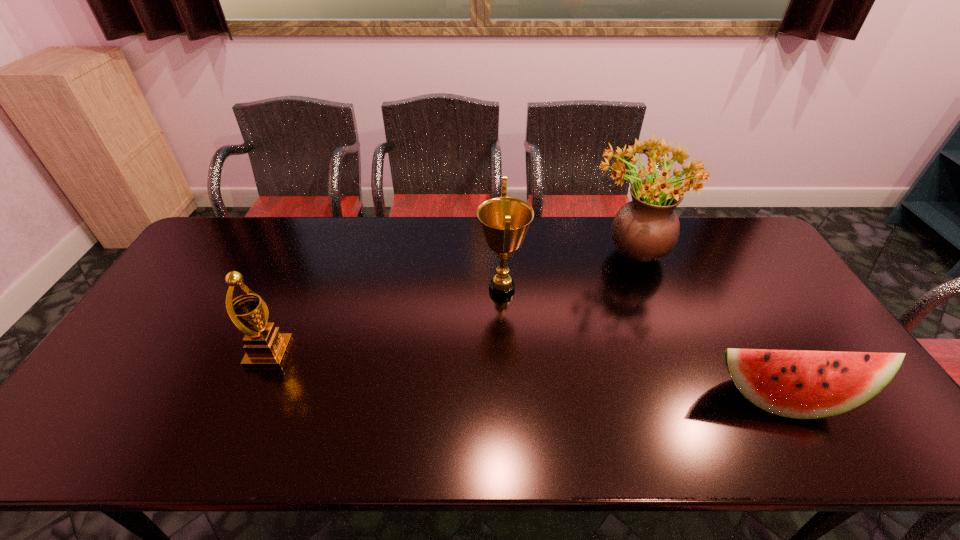
Where is `free point between the farther award and the flower arrangement`? Image resolution: width=960 pixels, height=540 pixels. free point between the farther award and the flower arrangement is located at coordinates click(565, 271).

Find the location of a particular element. This screenshot has width=960, height=540. vacant area between the third object from right to left and the flower arrangement is located at coordinates (565, 271).

I want to click on object that is the second nearest to the flower arrangement, so click(x=800, y=384).

Identify which object is the third closest to the shortest object. Please provide its 2D coordinates. Your answer should be formatted as a tuple, i.e. [(x, y)], where the tuple contains the x and y coordinates of a point satisfying the conditions above.

[(266, 347)]

The image size is (960, 540). What are the coordinates of `free space that satisfies the following two spatial constraints: 1. on the front side of the flower arrangement; 2. on the front-facing side of the third farthest object` in the screenshot? It's located at (668, 353).

The height and width of the screenshot is (540, 960). Find the location of `vacant space that satisfies the following two spatial constraints: 1. on the front side of the flower arrangement; 2. on the front-facing side of the third tallest object`. vacant space that satisfies the following two spatial constraints: 1. on the front side of the flower arrangement; 2. on the front-facing side of the third tallest object is located at coordinates (668, 353).